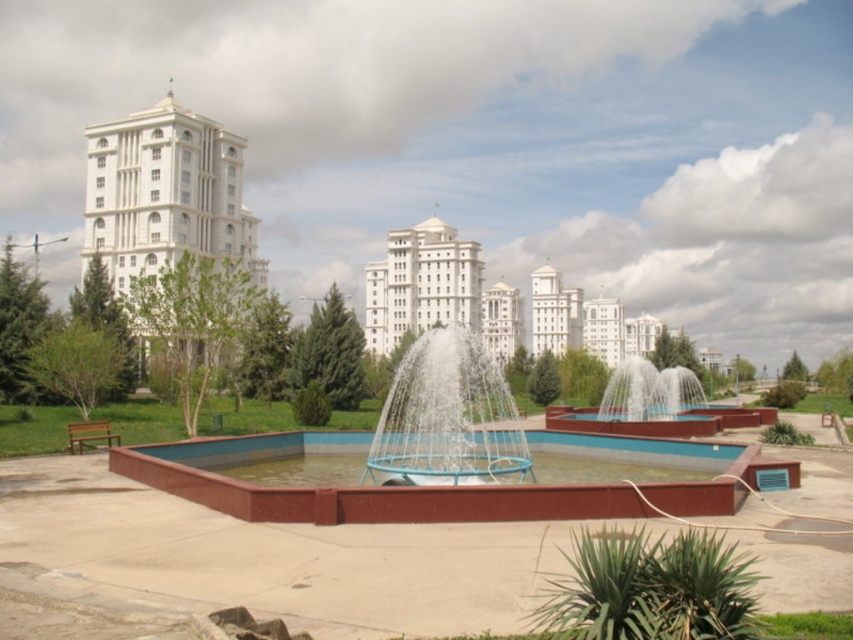
Question: Which object appears farthest from the camera in this image?

Choices:
 (A) blue concrete fountain at center
 (B) white glossy building at center
 (C) blue metallic fountain at center

Answer: (B)

Question: Is blue concrete fountain at center positioned before white glossy building at center?

Choices:
 (A) no
 (B) yes

Answer: (B)

Question: Which is nearer to the blue concrete fountain at center?

Choices:
 (A) white glossy building at upper left
 (B) white glossy building at center
 (C) blue metallic fountain at center

Answer: (C)

Question: Which of the following is the farthest from the observer?

Choices:
 (A) (173, 202)
 (B) (206, 440)
 (C) (434, 362)
 (D) (418, 307)

Answer: (D)

Question: Can you confirm if blue concrete fountain at center is thinner than blue metallic fountain at center?

Choices:
 (A) no
 (B) yes

Answer: (A)

Question: Is white glossy building at upper left to the right of white glossy building at center from the viewer's perspective?

Choices:
 (A) no
 (B) yes

Answer: (A)